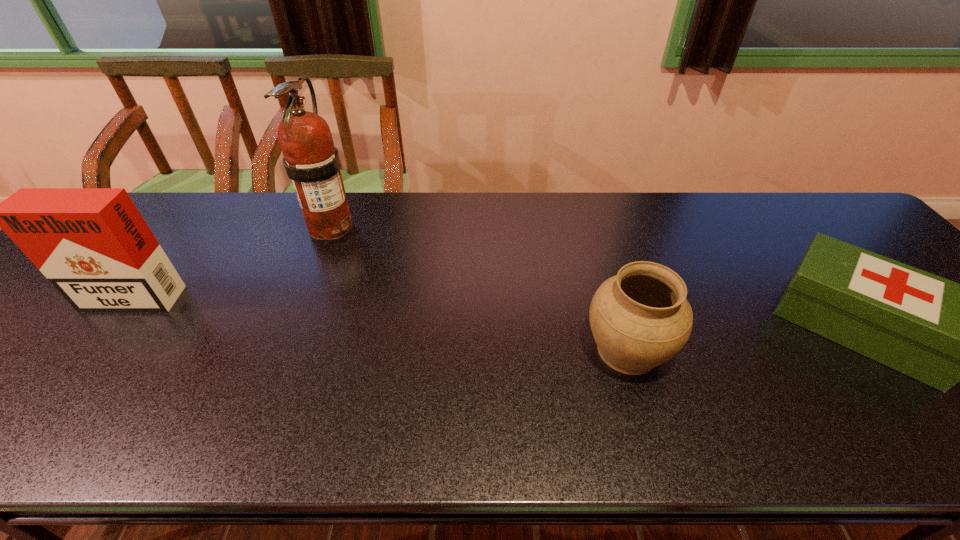
I want to click on the tallest object, so tap(312, 162).

In order to click on the third object from right to left in this screenshot , I will do `click(312, 162)`.

Locate an element on the screen. This screenshot has height=540, width=960. cigarette case is located at coordinates (93, 245).

What are the coordinates of `the third shortest object` in the screenshot? It's located at (93, 245).

Where is `the second object from right to left`? the second object from right to left is located at coordinates (640, 318).

Find the location of a particular element. urn is located at coordinates (640, 318).

Find the location of a particular element. vacant region located at the nozzle of the fire extinguisher is located at coordinates (313, 272).

You are a GUI agent. You are given a task and a screenshot of the screen. Output one action in this format:
    pyautogui.click(x=<x>, y=<y>)
    Task: Click on the vacant space positioned 0.280m on the front-facing side of the leftmost object
    The image size is (960, 540).
    Given the screenshot: What is the action you would take?
    pyautogui.click(x=25, y=420)

Where is `free space located on the front of the third object from left to right`? This screenshot has width=960, height=540. free space located on the front of the third object from left to right is located at coordinates (645, 411).

Where is `object at the far edge`? object at the far edge is located at coordinates (312, 162).